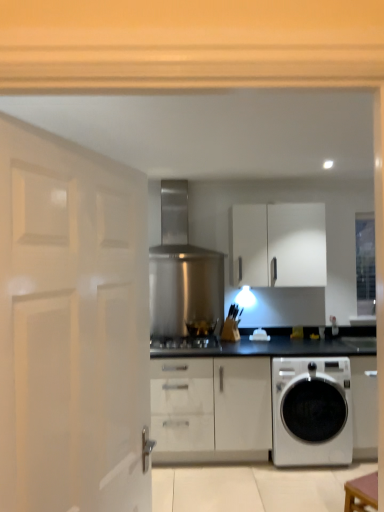
Question: From the image's perspective, does satin silver gas stove at center appear higher than white glossy washing machine at lower right?

Choices:
 (A) no
 (B) yes

Answer: (B)

Question: Does satin silver gas stove at center come in front of white glossy washing machine at lower right?

Choices:
 (A) no
 (B) yes

Answer: (A)

Question: From a real-world perspective, is satin silver gas stove at center positioned under white glossy washing machine at lower right based on gravity?

Choices:
 (A) no
 (B) yes

Answer: (A)

Question: From the image's perspective, is satin silver gas stove at center beneath white glossy washing machine at lower right?

Choices:
 (A) no
 (B) yes

Answer: (A)

Question: Is satin silver gas stove at center shorter than white glossy washing machine at lower right?

Choices:
 (A) no
 (B) yes

Answer: (B)

Question: From a real-world perspective, is black glass stove at center physically located above or below satin silver gas stove at center?

Choices:
 (A) below
 (B) above

Answer: (B)

Question: Considering the positions of point (192, 331) and point (208, 337), is point (192, 331) closer or farther from the camera than point (208, 337)?

Choices:
 (A) closer
 (B) farther

Answer: (B)

Question: From the image's perspective, is black glass stove at center positioned above or below satin silver gas stove at center?

Choices:
 (A) above
 (B) below

Answer: (A)

Question: Choose the correct answer: Is black glass stove at center inside satin silver gas stove at center or outside it?

Choices:
 (A) inside
 (B) outside

Answer: (B)

Question: Is satin silver gas stove at center wider or thinner than black glass stove at center?

Choices:
 (A) wide
 (B) thin

Answer: (A)

Question: From a real-world perspective, is satin silver gas stove at center physically located above or below black glass stove at center?

Choices:
 (A) above
 (B) below

Answer: (B)

Question: In the image, is satin silver gas stove at center on the left side or the right side of black glass stove at center?

Choices:
 (A) right
 (B) left

Answer: (B)

Question: From the image's perspective, is satin silver gas stove at center located above or below black glass stove at center?

Choices:
 (A) above
 (B) below

Answer: (B)

Question: In terms of height, does satin silver gas stove at center look taller or shorter compared to white glossy door at left?

Choices:
 (A) tall
 (B) short

Answer: (B)

Question: From the image's perspective, is satin silver gas stove at center positioned above or below white glossy door at left?

Choices:
 (A) below
 (B) above

Answer: (A)